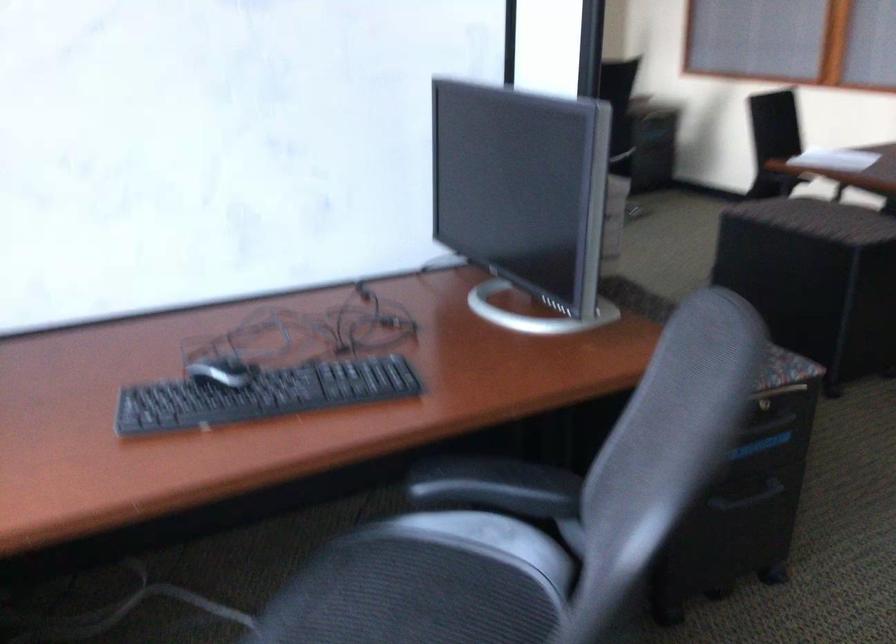
Where is `black chair armrest`? black chair armrest is located at coordinates (495, 486).